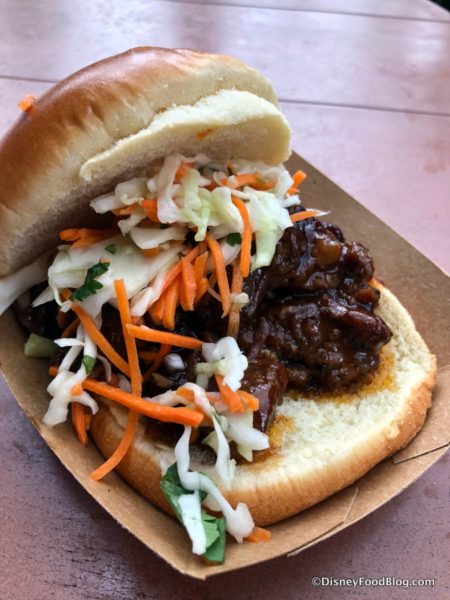
Identify the location of cardboard basket. The width and height of the screenshot is (450, 600). (354, 507).